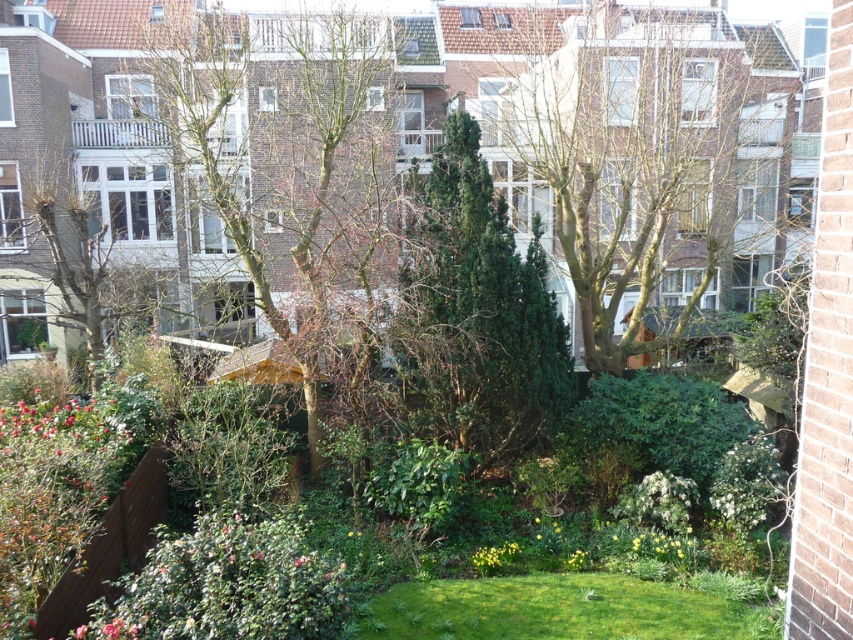
Question: Does green leafy bush at lower left appear over smooth gray tree at left?

Choices:
 (A) yes
 (B) no

Answer: (B)

Question: Does bare branches at center appear under green leafy bush at lower left?

Choices:
 (A) yes
 (B) no

Answer: (B)

Question: Which of these objects is positioned closest to the green leafy bush at lower left?

Choices:
 (A) green grass at center
 (B) smooth gray tree at left
 (C) green textured tree at center

Answer: (A)

Question: Is green leafy bush at lower left above smooth gray tree at left?

Choices:
 (A) no
 (B) yes

Answer: (A)

Question: Which point is closer to the camera?

Choices:
 (A) (440, 208)
 (B) (692, 56)

Answer: (A)

Question: Among these objects, which one is nearest to the camera?

Choices:
 (A) green grass at center
 (B) bare branches at center
 (C) green leafy tree at center

Answer: (A)